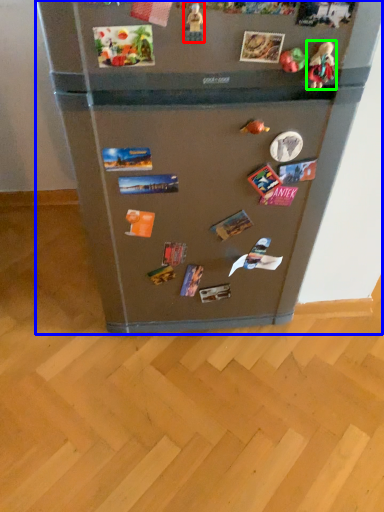
Question: Based on their relative distances, which object is nearer to toy (highlighted by a red box)? Choose from refrigerator (highlighted by a blue box) and toy (highlighted by a green box).

Choices:
 (A) refrigerator
 (B) toy

Answer: (B)